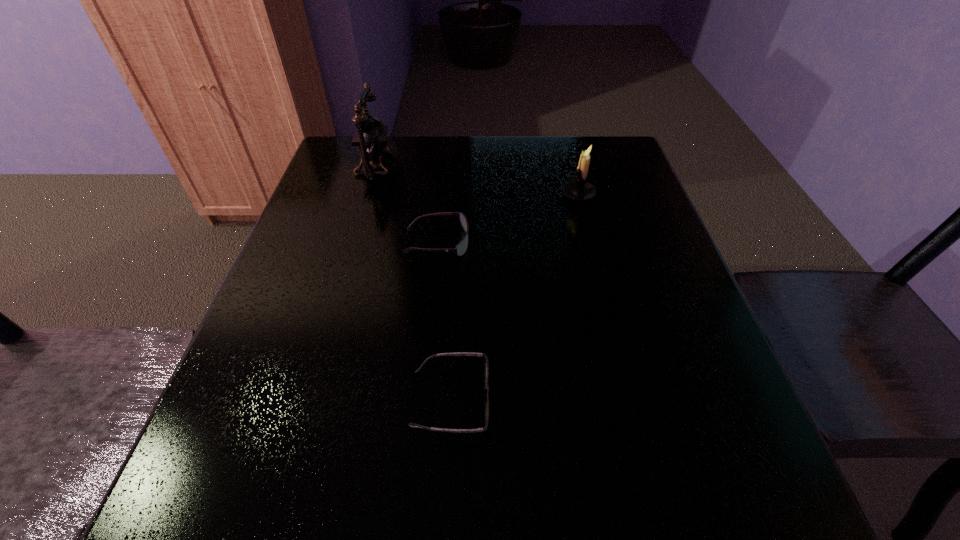
Find the location of `empty space between the second tallest object and the tallest object`. empty space between the second tallest object and the tallest object is located at coordinates (478, 180).

This screenshot has height=540, width=960. I want to click on free spot between the farthest object and the second shortest object, so click(x=407, y=204).

Find the location of a particular element. the closest object to the nearer sunglasses is located at coordinates (461, 248).

In order to click on the closest object relative to the second tallest object in this screenshot , I will do `click(461, 248)`.

Locate an element on the screen. Image resolution: width=960 pixels, height=540 pixels. free location that satisfies the following two spatial constraints: 1. on the front side of the candle holder; 2. on the front-facing side of the shorter sunglasses is located at coordinates (633, 399).

Find the location of a particular element. Image resolution: width=960 pixels, height=540 pixels. free space that satisfies the following two spatial constraints: 1. on the rotary dial of the leftmost object; 2. on the back side of the second tallest object is located at coordinates (370, 194).